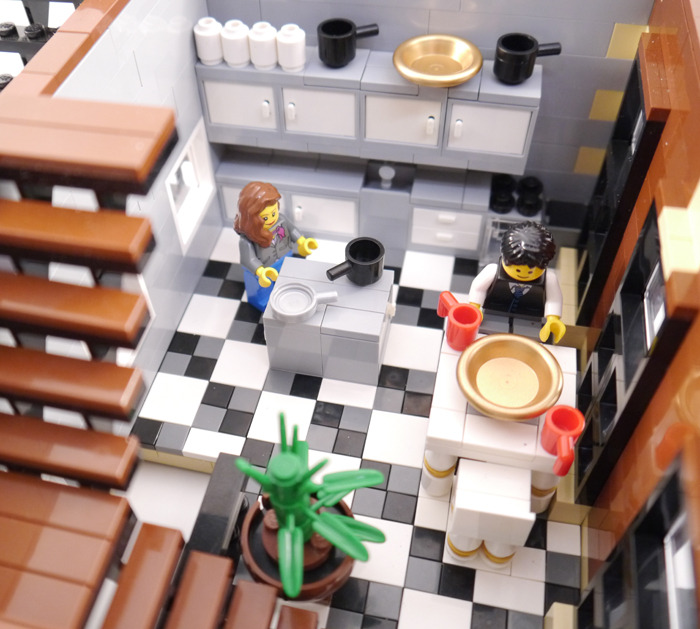
Where is `gray floor tile`? gray floor tile is located at coordinates [x=211, y=420].